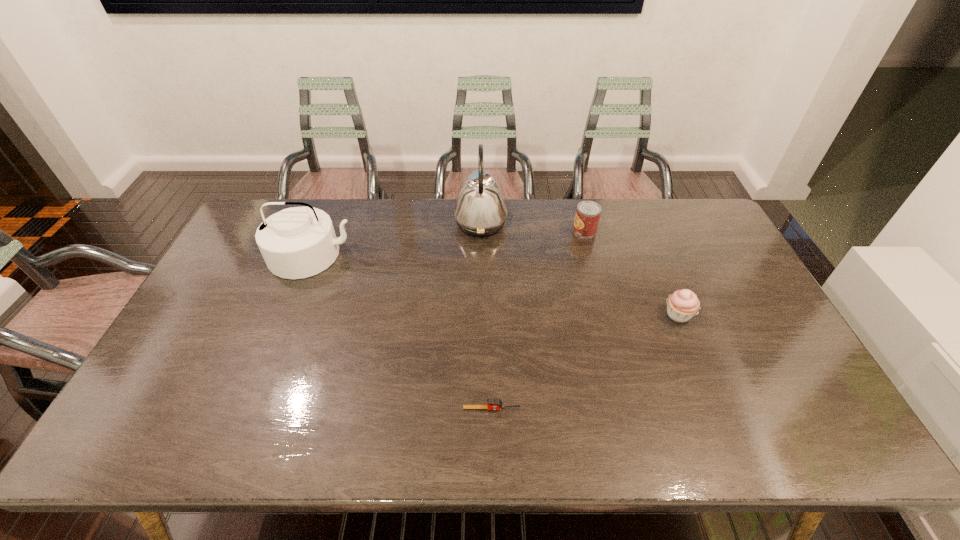
You are a GUI agent. You are given a task and a screenshot of the screen. Output one action in this format:
    pyautogui.click(x=<x>, y=<y>)
    Task: Click on the vacant space at the near edge of the desktop
    This screenshot has height=540, width=960.
    Given the screenshot: What is the action you would take?
    pyautogui.click(x=333, y=441)

In the image, there is a desktop. Where is `blank space at the right edge`? The width and height of the screenshot is (960, 540). blank space at the right edge is located at coordinates (768, 332).

Where is `free space at the far left corner of the desktop`? free space at the far left corner of the desktop is located at coordinates (263, 202).

Find the location of a particular element. vacant region between the tape measure and the tallest object is located at coordinates (486, 315).

Image resolution: width=960 pixels, height=540 pixels. Identify the location of free spot between the right kettle and the can. (533, 227).

This screenshot has height=540, width=960. Find the location of `empty space that is in between the leftmost object and the nearest object`. empty space that is in between the leftmost object and the nearest object is located at coordinates (402, 332).

This screenshot has width=960, height=540. I want to click on vacant space that is in between the fourth object from left to right and the shorter kettle, so click(448, 243).

Locate an element on the screen. The height and width of the screenshot is (540, 960). free area in between the leftmost object and the tape measure is located at coordinates (402, 332).

I want to click on free point between the rightmost object and the leftmost object, so click(x=495, y=285).

This screenshot has width=960, height=540. Find the location of `vacant space that is in between the tape measure and the rightmost object`. vacant space that is in between the tape measure and the rightmost object is located at coordinates (585, 362).